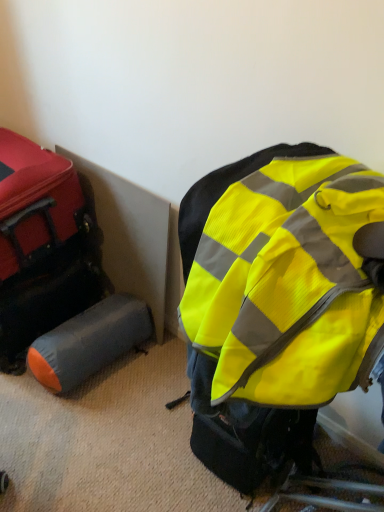
Question: Is gray fabric cylinder at lower left, which is counted as the 1th luggage, starting from the bottom, at the back of orange-gray fabric sleeping bag at lower left?

Choices:
 (A) no
 (B) yes

Answer: (A)

Question: Considering the relative positions of orange-gray fabric sleeping bag at lower left and gray fabric cylinder at lower left, the second luggage from the top, in the image provided, is orange-gray fabric sleeping bag at lower left to the left of gray fabric cylinder at lower left, the second luggage from the top, from the viewer's perspective?

Choices:
 (A) yes
 (B) no

Answer: (A)

Question: Is orange-gray fabric sleeping bag at lower left closer to camera compared to gray fabric cylinder at lower left, which is counted as the 1th luggage, starting from the bottom?

Choices:
 (A) no
 (B) yes

Answer: (A)

Question: From the image's perspective, is orange-gray fabric sleeping bag at lower left below gray fabric cylinder at lower left, the second luggage from the top?

Choices:
 (A) yes
 (B) no

Answer: (B)

Question: From a real-world perspective, is orange-gray fabric sleeping bag at lower left on top of gray fabric cylinder at lower left, the second luggage from the top?

Choices:
 (A) yes
 (B) no

Answer: (A)

Question: Would you say high-visibility fabric backpack at center is to the left or to the right of matte red suitcase at left, placed as the second luggage when sorted from bottom to top, in the picture?

Choices:
 (A) right
 (B) left

Answer: (A)

Question: From a real-world perspective, relative to matte red suitcase at left, placed as the second luggage when sorted from bottom to top, is high-visibility fabric backpack at center vertically above or below?

Choices:
 (A) below
 (B) above

Answer: (A)

Question: Looking at the image, does high-visibility fabric backpack at center seem bigger or smaller compared to matte red suitcase at left, marked as the first luggage in a top-to-bottom arrangement?

Choices:
 (A) big
 (B) small

Answer: (A)

Question: Considering the positions of point (322, 367) and point (31, 148), is point (322, 367) closer or farther from the camera than point (31, 148)?

Choices:
 (A) farther
 (B) closer

Answer: (B)

Question: Is gray fabric cylinder at lower left, which is counted as the 1th luggage, starting from the bottom, situated inside orange-gray fabric sleeping bag at lower left or outside?

Choices:
 (A) outside
 (B) inside

Answer: (A)

Question: Considering the relative positions of gray fabric cylinder at lower left, the second luggage from the top, and orange-gray fabric sleeping bag at lower left in the image provided, is gray fabric cylinder at lower left, the second luggage from the top, to the left or to the right of orange-gray fabric sleeping bag at lower left?

Choices:
 (A) right
 (B) left

Answer: (A)

Question: Is gray fabric cylinder at lower left, the second luggage from the top, in front of or behind orange-gray fabric sleeping bag at lower left in the image?

Choices:
 (A) front
 (B) behind

Answer: (A)

Question: From a real-world perspective, relative to orange-gray fabric sleeping bag at lower left, is gray fabric cylinder at lower left, the second luggage from the top, vertically above or below?

Choices:
 (A) below
 (B) above

Answer: (A)

Question: Considering the positions of gray fabric cylinder at lower left, the second luggage from the top, and matte red suitcase at left, marked as the first luggage in a top-to-bottom arrangement, in the image, is gray fabric cylinder at lower left, the second luggage from the top, taller or shorter than matte red suitcase at left, marked as the first luggage in a top-to-bottom arrangement,?

Choices:
 (A) short
 (B) tall

Answer: (A)

Question: In terms of width, does gray fabric cylinder at lower left, which is counted as the 1th luggage, starting from the bottom, look wider or thinner when compared to matte red suitcase at left, placed as the second luggage when sorted from bottom to top?

Choices:
 (A) thin
 (B) wide

Answer: (B)